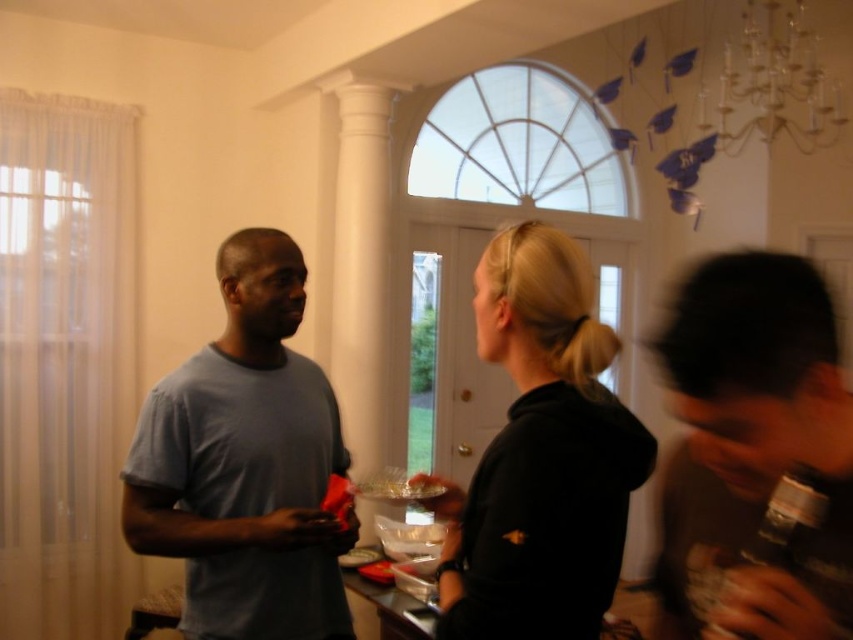
Is light blue t-shirt at center below matte gray t-shirt at left?

Actually, light blue t-shirt at center is above matte gray t-shirt at left.

Who is shorter, light blue t-shirt at center or matte gray t-shirt at left?

light blue t-shirt at center

Between point (567, 273) and point (199, 600), which one is positioned in front?

Point (567, 273) is more forward.

The image size is (853, 640). What are the coordinates of `light blue t-shirt at center` in the screenshot? It's located at (755, 451).

Locate an element on the screen. This screenshot has height=640, width=853. dark gray matte shirt at right is located at coordinates (755, 454).

Is dark gray matte shirt at right above matte gray t-shirt at left?

Yes.

Is point (770, 618) behind point (196, 528)?

That is False.

This screenshot has height=640, width=853. Find the location of `dark gray matte shirt at right`. dark gray matte shirt at right is located at coordinates (755, 454).

In the scene shown: Can you confirm if dark gray matte shirt at right is taller than black matte hoodie at center?

Incorrect, dark gray matte shirt at right's height is not larger of black matte hoodie at center's.

Is point (779, 433) more distant than point (498, 576)?

No.

You are a GUI agent. You are given a task and a screenshot of the screen. Output one action in this format:
    pyautogui.click(x=<x>, y=<y>)
    Task: Click on the dark gray matte shirt at right
    This screenshot has width=853, height=640.
    Given the screenshot: What is the action you would take?
    pyautogui.click(x=755, y=454)